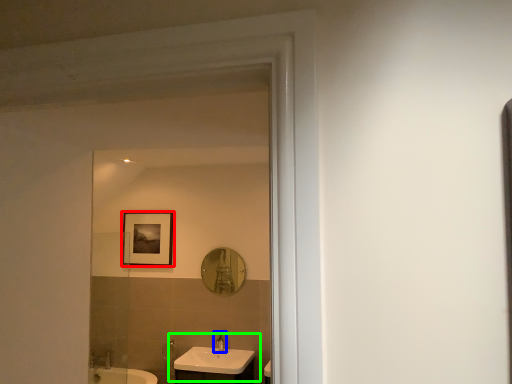
Question: Based on their relative distances, which object is farther from picture frame (highlighted by a red box)? Choose from tap (highlighted by a blue box) and sink (highlighted by a green box).

Choices:
 (A) tap
 (B) sink

Answer: (A)